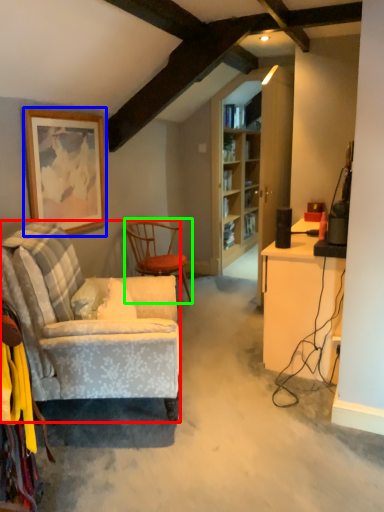
Question: Considering the real-world distances, which object is closest to chair (highlighted by a red box)? picture frame (highlighted by a blue box) or chair (highlighted by a green box).

Choices:
 (A) picture frame
 (B) chair

Answer: (A)